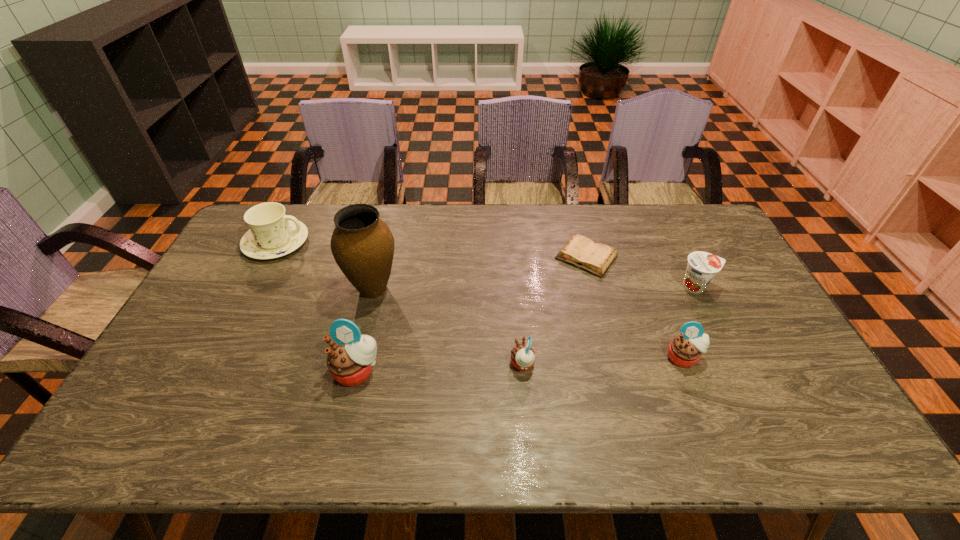
At what (x,y) coordinates should I click in order to perform the action: click on the second tallest object. Please return your answer as a coordinate pair (x, y). Image resolution: width=960 pixels, height=540 pixels. Looking at the image, I should click on (350, 360).

The height and width of the screenshot is (540, 960). What are the coordinates of `the leftmost muffin` in the screenshot? It's located at (350, 360).

Find the location of `the shortest muffin`. the shortest muffin is located at coordinates (522, 355).

Locate an element on the screen. This screenshot has width=960, height=540. the fourth object from right to left is located at coordinates (522, 355).

This screenshot has width=960, height=540. Identify the location of the rightmost muffin. (685, 350).

Identify the location of the sixth object from left to right. click(x=685, y=350).

What are the coordinates of `the tallest object` in the screenshot? It's located at (362, 244).

Locate an element on the screen. the leftmost object is located at coordinates (272, 234).

Locate an element on the screen. The height and width of the screenshot is (540, 960). the third object from right to left is located at coordinates (580, 251).

The height and width of the screenshot is (540, 960). What are the coordinates of `the shortest object` in the screenshot? It's located at (580, 251).